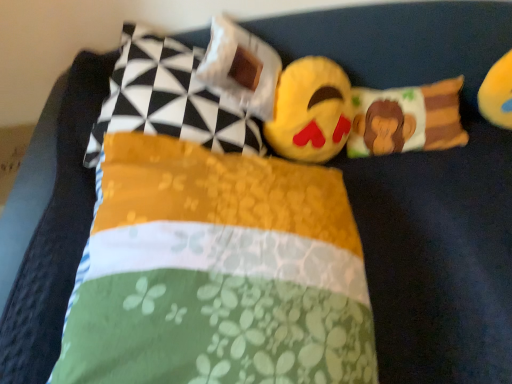
The height and width of the screenshot is (384, 512). Find the location of `vacant region above soft plush emoji at center, the first toy when ordered from left to right (from a real-world perspective)`. vacant region above soft plush emoji at center, the first toy when ordered from left to right (from a real-world perspective) is located at coordinates (301, 82).